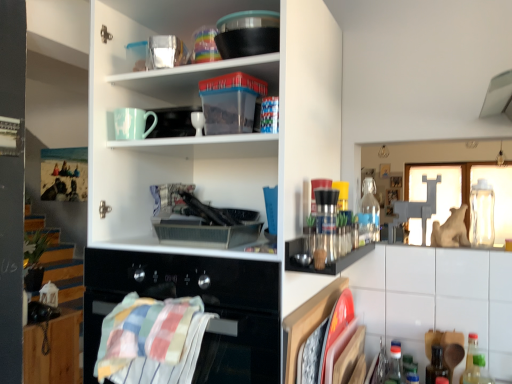
Find the location of a particular element. The image size is (512, 384). empty space that is ontop of wooden cabinet at lower left, arranged as the 1th cabinetry when viewed from the left (from a real-world perspective) is located at coordinates (48, 316).